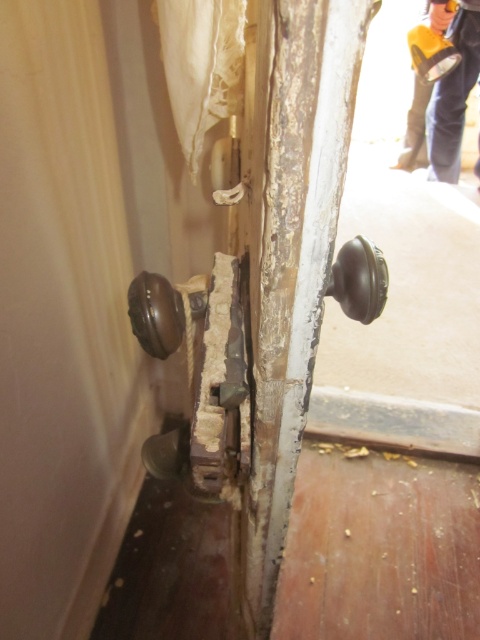
Which is behind, point (457, 81) or point (173, 340)?

Positioned behind is point (457, 81).

Which is above, orange fabric pants at upper right or shiny dark brown knob at lower left?

orange fabric pants at upper right

Is point (448, 19) behind point (147, 349)?

Yes, point (448, 19) is farther from viewer.

In order to click on orange fabric pants at upper right in this screenshot , I will do `click(453, 97)`.

How far apart are orange fabric pants at upper right and matte brown door handle at lower left?

orange fabric pants at upper right is 3.15 meters away from matte brown door handle at lower left.

Can you confirm if orange fabric pants at upper right is taller than matte brown door handle at lower left?

Yes, orange fabric pants at upper right is taller than matte brown door handle at lower left.

Between point (451, 176) and point (165, 448), which one is positioned in front?

Point (165, 448)

You are a GUI agent. You are given a task and a screenshot of the screen. Output one action in this format:
    pyautogui.click(x=<x>, y=<y>)
    Task: Click on the orange fabric pants at upper right
    This screenshot has width=480, height=640.
    Given the screenshot: What is the action you would take?
    (453, 97)

Between matte brown door handle at center and shiny dark brown knob at right, which one has more height?

matte brown door handle at center

Based on the photo, does matte brown door handle at center appear under shiny dark brown knob at right?

Yes.

Between point (359, 32) and point (346, 301), which one is positioned in front?

Point (359, 32)

Locate an element on the screen. This screenshot has height=640, width=480. matte brown door handle at center is located at coordinates (252, 348).